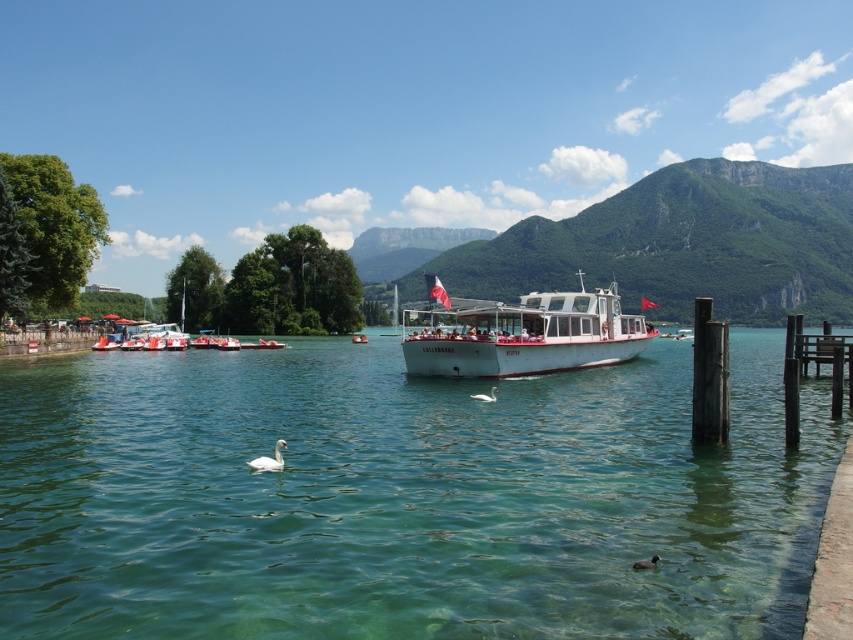
Question: Which of the following is the farthest from the observer?

Choices:
 (A) (494, 388)
 (B) (253, 465)
 (C) (579, 316)
 (D) (784, 422)

Answer: (C)

Question: Can you confirm if wooden dock at right is bigger than white glossy swan at lower center?

Choices:
 (A) no
 (B) yes

Answer: (B)

Question: Does clear water at center have a larger size compared to white matte swan at center?

Choices:
 (A) no
 (B) yes

Answer: (B)

Question: Which point is closer to the camera taking this photo?

Choices:
 (A) (791, 381)
 (B) (62, 355)
 (C) (491, 388)

Answer: (A)

Question: Which point is farther to the camera?

Choices:
 (A) wooden dock at right
 (B) white glossy swan at lower center
 (C) white matte boat at center

Answer: (C)

Question: Does white matte boat at center appear on the left side of wooden dock at right?

Choices:
 (A) no
 (B) yes

Answer: (B)